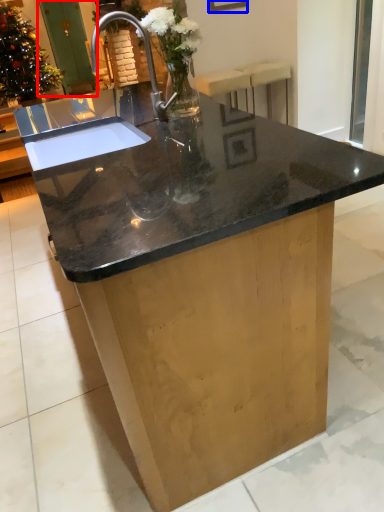
Question: Which object appears closest to the camera in this image, screen door (highlighted by a red box) or picture frame (highlighted by a blue box)?

Choices:
 (A) screen door
 (B) picture frame

Answer: (B)